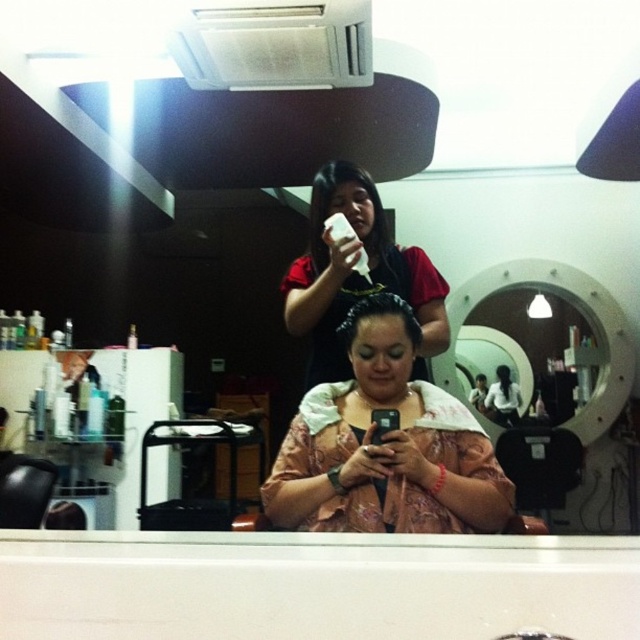
Question: Which point is closer to the camera?

Choices:
 (A) (481, 520)
 (B) (330, 212)

Answer: (A)

Question: Which is nearer to the glossy white mirror at center?

Choices:
 (A) matte black phone at center
 (B) floral fabric phone at center
 (C) brown matte hair at center

Answer: (A)

Question: Can you confirm if floral fabric phone at center is thinner than matte black hairdryer at upper center?

Choices:
 (A) yes
 (B) no

Answer: (B)

Question: Does floral fabric phone at center appear on the left side of glossy white mirror at center?

Choices:
 (A) no
 (B) yes

Answer: (B)

Question: Estimate the real-world distances between objects in this image. Which object is farther from the brown matte hair at center?

Choices:
 (A) glossy white mirror at center
 (B) matte black hairdryer at upper center
 (C) matte black phone at center

Answer: (A)

Question: Considering the relative positions of glossy white mirror at center and matte black phone at center in the image provided, where is glossy white mirror at center located with respect to matte black phone at center?

Choices:
 (A) above
 (B) below

Answer: (A)